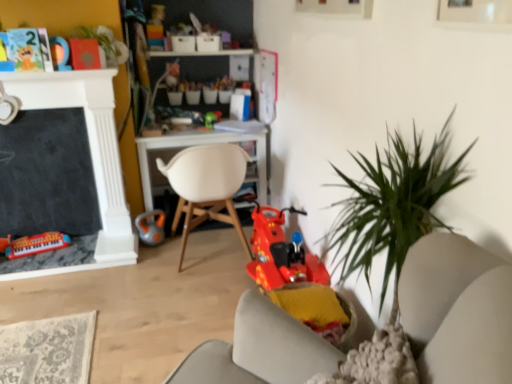
The width and height of the screenshot is (512, 384). I want to click on vacant space situated on the left part of shiny plastic scooter at center, the 1th toy when ordered from right to left, so click(190, 296).